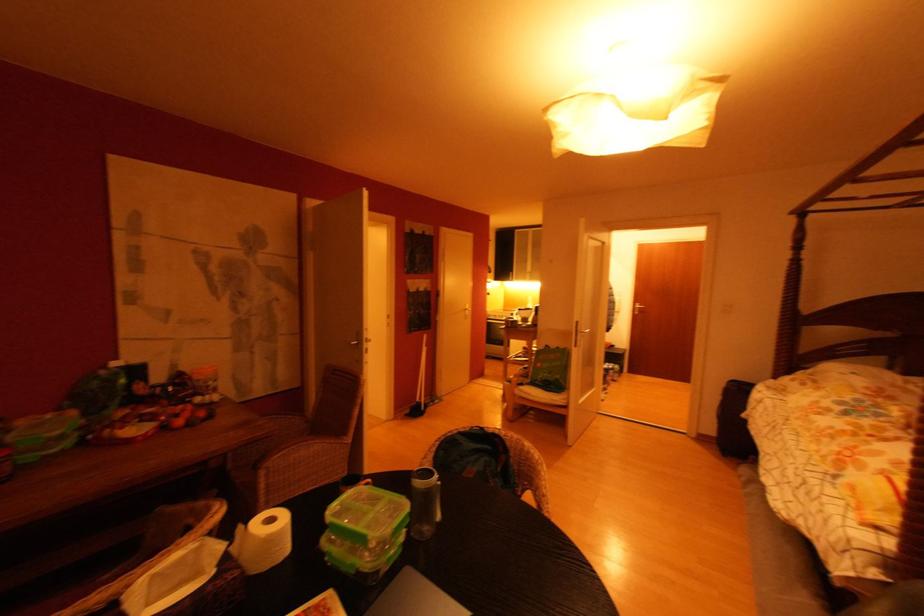
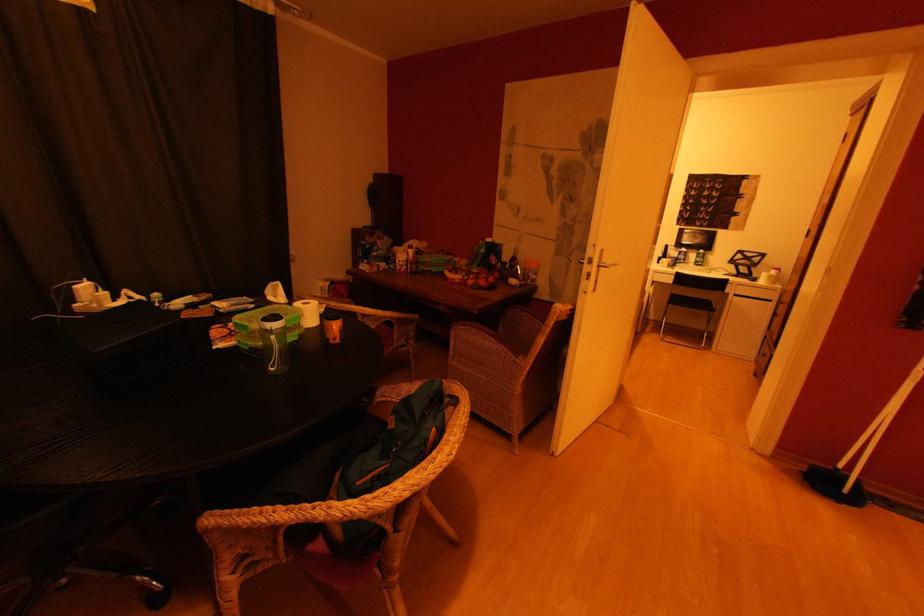
The point at (207,415) is marked in the first image. Where is the corresponding point in the second image?

(488, 285)